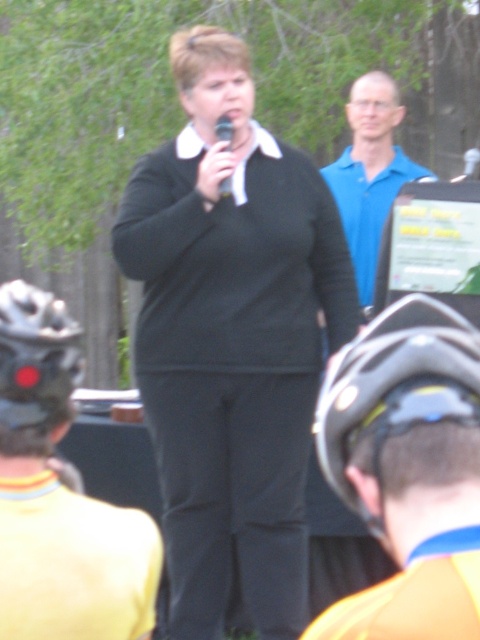
You are a photographer at the event and need to capture a photo where both the black matte bicycle helmet at lower right and the blue smooth shirt at upper center are clearly visible. Based on their sizes in the image, which object should you focus on first to ensure both are in frame?

The black matte bicycle helmet at lower right is smaller than the blue smooth shirt at upper center. To ensure both are in frame, focus on the blue smooth shirt at upper center first since it is larger and will be easier to position within the shot, allowing the smaller helmet to also fit.

You are a photographer at the event and want to capture a photo where both the black matte sweater at center and the black matte bicycle helmet at lower right are visible. Based on their sizes, which object should you ensure is closer to the camera to include both in the frame?

The black matte sweater at center is taller than the black matte bicycle helmet at lower right, so to include both in the frame, you should position the camera closer to the black matte sweater at center to ensure both objects are visible.

You are standing at the point marked as point [395,388]. Looking around, you see a black matte bicycle helmet at lower right. Where is the black matte bicycle helmet located relative to your current position?

The black matte bicycle helmet at lower right is located at the point marked as point [395,388].